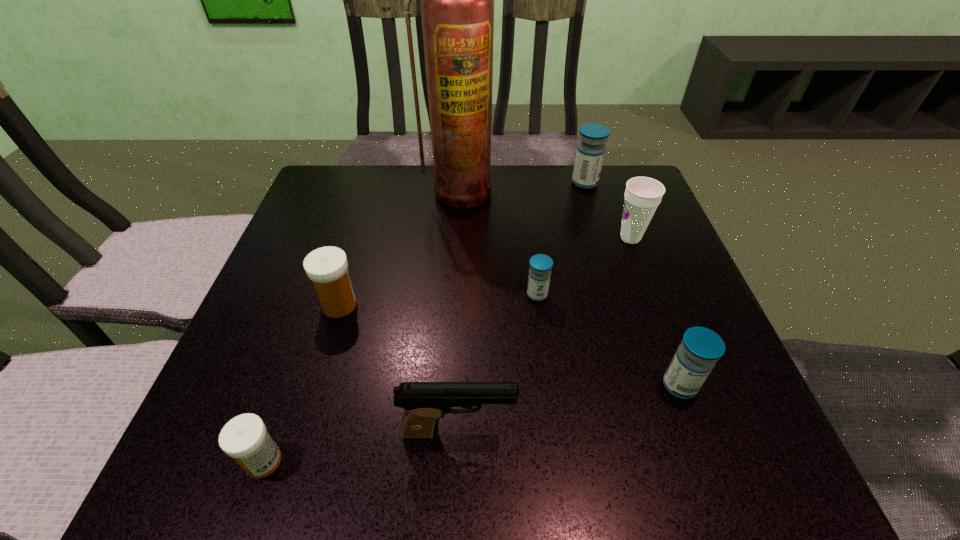
Identify which medicine is the second nearest to the nearest blue medicine. Please provide its 2D coordinates. Your answer should be formatted as a tuple, i.e. [(x, y)], where the tuple contains the x and y coordinates of a point satisfying the conditions above.

[(590, 153)]

Identify which medicine is located as the second nearest to the smallest blue medicine. Please provide its 2D coordinates. Your answer should be formatted as a tuple, i.e. [(x, y)], where the tuple contains the x and y coordinates of a point satisfying the conditions above.

[(327, 267)]

Identify which blue medicine is located as the third nearest to the smaller white medicine. Please provide its 2D coordinates. Your answer should be formatted as a tuple, i.e. [(x, y)], where the tuple contains the x and y coordinates of a point satisfying the conditions above.

[(590, 153)]

Select which blue medicine appears as the second closest to the fourth farthest medicine. Please provide its 2D coordinates. Your answer should be formatted as a tuple, i.e. [(x, y)], where the tuple contains the x and y coordinates of a point satisfying the conditions above.

[(590, 153)]

Locate an element on the screen. Image resolution: width=960 pixels, height=540 pixels. vacant position in the image that satisfies the following two spatial constraints: 1. on the front side of the fifth object from left to right; 2. on the right side of the nearest blue medicine is located at coordinates (548, 386).